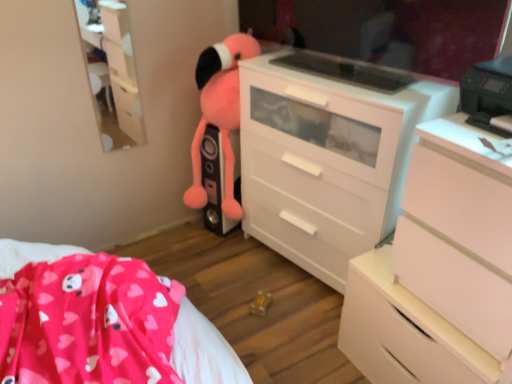
Question: Considering the relative sizes of pink plush toy at center and white matte chest of drawers at right, which ranks as the second chest of drawers in back-to-front order, in the image provided, is pink plush toy at center smaller than white matte chest of drawers at right, which ranks as the second chest of drawers in back-to-front order,?

Choices:
 (A) no
 (B) yes

Answer: (B)

Question: Considering the relative sizes of pink plush toy at center and white matte chest of drawers at right, which ranks as the second chest of drawers in back-to-front order, in the image provided, is pink plush toy at center taller than white matte chest of drawers at right, which ranks as the second chest of drawers in back-to-front order,?

Choices:
 (A) yes
 (B) no

Answer: (A)

Question: Does pink plush toy at center have a lesser height compared to white matte chest of drawers at right, the first chest of drawers viewed from the front?

Choices:
 (A) no
 (B) yes

Answer: (A)

Question: Is pink plush toy at center oriented away from white matte chest of drawers at right, which ranks as the second chest of drawers in back-to-front order?

Choices:
 (A) yes
 (B) no

Answer: (B)

Question: Does pink plush toy at center appear on the left side of white matte chest of drawers at right, which ranks as the second chest of drawers in back-to-front order?

Choices:
 (A) yes
 (B) no

Answer: (A)

Question: Considering the positions of pink plush toy at center and glossy plastic mirror at upper center in the image, is pink plush toy at center bigger or smaller than glossy plastic mirror at upper center?

Choices:
 (A) big
 (B) small

Answer: (A)

Question: In terms of width, does pink plush toy at center look wider or thinner when compared to glossy plastic mirror at upper center?

Choices:
 (A) thin
 (B) wide

Answer: (B)

Question: From a real-world perspective, is pink plush toy at center positioned above or below glossy plastic mirror at upper center?

Choices:
 (A) above
 (B) below

Answer: (B)

Question: Considering the positions of pink plush toy at center and glossy plastic mirror at upper center in the image, is pink plush toy at center taller or shorter than glossy plastic mirror at upper center?

Choices:
 (A) tall
 (B) short

Answer: (A)

Question: Is white matte drawer at center in front of or behind matte white cabinet at upper left in the image?

Choices:
 (A) front
 (B) behind

Answer: (A)

Question: From the image's perspective, is white matte drawer at center positioned above or below matte white cabinet at upper left?

Choices:
 (A) above
 (B) below

Answer: (B)

Question: Is white matte drawer at center taller or shorter than matte white cabinet at upper left?

Choices:
 (A) short
 (B) tall

Answer: (A)

Question: Does point (400, 365) appear closer or farther from the camera than point (138, 104)?

Choices:
 (A) closer
 (B) farther

Answer: (A)

Question: Is glossy plastic mirror at upper center wider or thinner than matte white cabinet at upper left?

Choices:
 (A) thin
 (B) wide

Answer: (B)

Question: Is point (346, 13) positioned closer to the camera than point (91, 49)?

Choices:
 (A) closer
 (B) farther

Answer: (A)